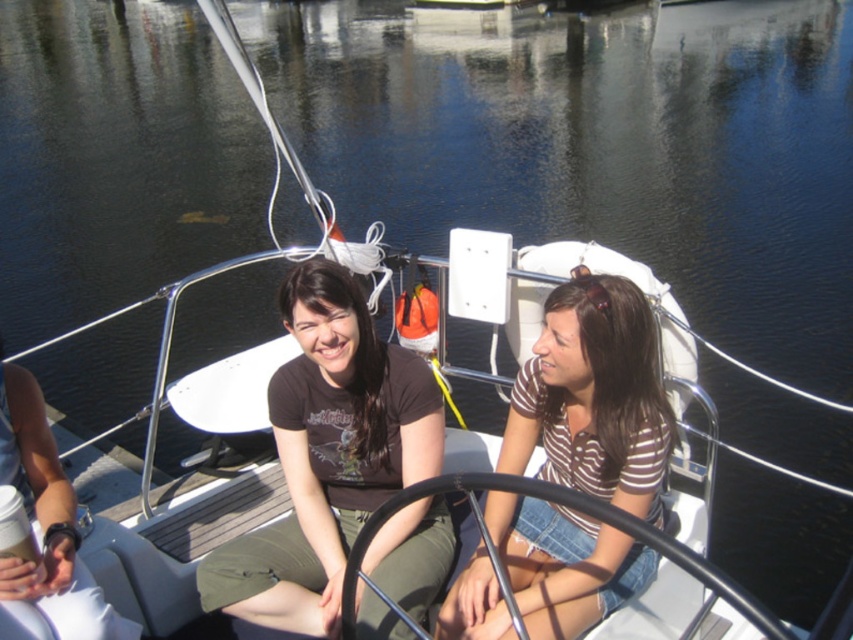
Question: Which object is positioned farthest from the white matte cup at lower left?

Choices:
 (A) matte black shirt at center
 (B) brown striped shirt at center

Answer: (B)

Question: Can you confirm if brown striped shirt at center is smaller than white matte cup at lower left?

Choices:
 (A) yes
 (B) no

Answer: (B)

Question: Is matte black shirt at center wider than brown striped shirt at center?

Choices:
 (A) yes
 (B) no

Answer: (A)

Question: Can you confirm if brown striped shirt at center is bigger than white matte cup at lower left?

Choices:
 (A) no
 (B) yes

Answer: (B)

Question: Which of the following is the closest to the observer?

Choices:
 (A) brown striped shirt at center
 (B) matte black shirt at center
 (C) white matte cup at lower left

Answer: (C)

Question: Which of these objects is positioned farthest from the matte black shirt at center?

Choices:
 (A) white matte cup at lower left
 (B) brown striped shirt at center

Answer: (A)